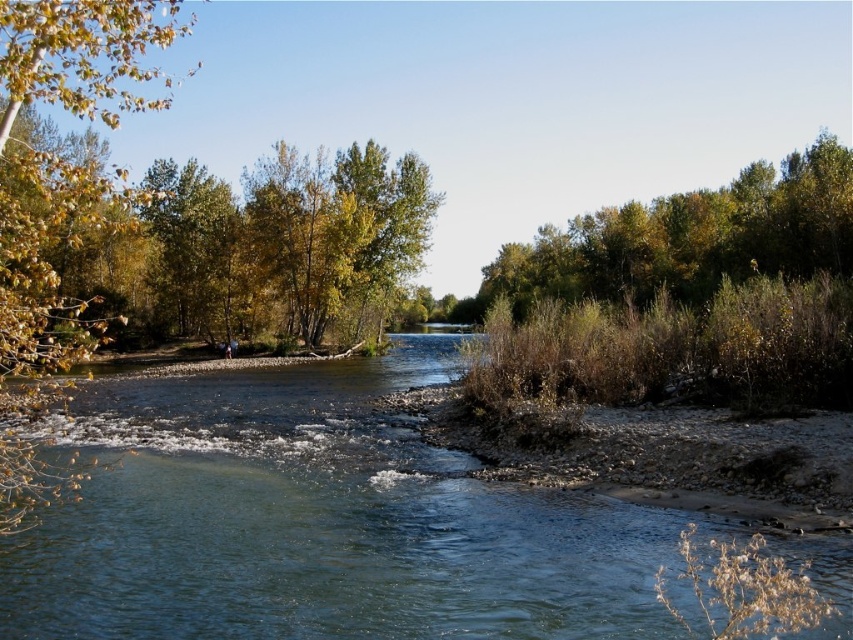
Is point (183, 573) farther from camera compared to point (834, 244)?

No, (183, 573) is in front of (834, 244).

Does clear blue water at center have a smaller size compared to green leafy tree at upper right?

Yes, clear blue water at center is smaller than green leafy tree at upper right.

Describe the element at coordinates (320, 522) in the screenshot. I see `clear blue water at center` at that location.

The height and width of the screenshot is (640, 853). What are the coordinates of `clear blue water at center` in the screenshot? It's located at (320, 522).

Does yellow-green leaves at left have a lesser width compared to green leafy tree at upper right?

Indeed, yellow-green leaves at left has a lesser width compared to green leafy tree at upper right.

Which is in front, point (4, 468) or point (665, 280)?

Point (4, 468)

Locate an element on the screen. This screenshot has height=640, width=853. yellow-green leaves at left is located at coordinates (57, 202).

From the picture: Does clear blue water at center have a greater width compared to yellow-green leaves at left?

In fact, clear blue water at center might be narrower than yellow-green leaves at left.

Between point (485, 548) and point (20, 248), which one is positioned behind?

Positioned behind is point (485, 548).

This screenshot has width=853, height=640. What do you see at coordinates (320, 522) in the screenshot? I see `clear blue water at center` at bounding box center [320, 522].

The image size is (853, 640). I want to click on clear blue water at center, so click(x=320, y=522).